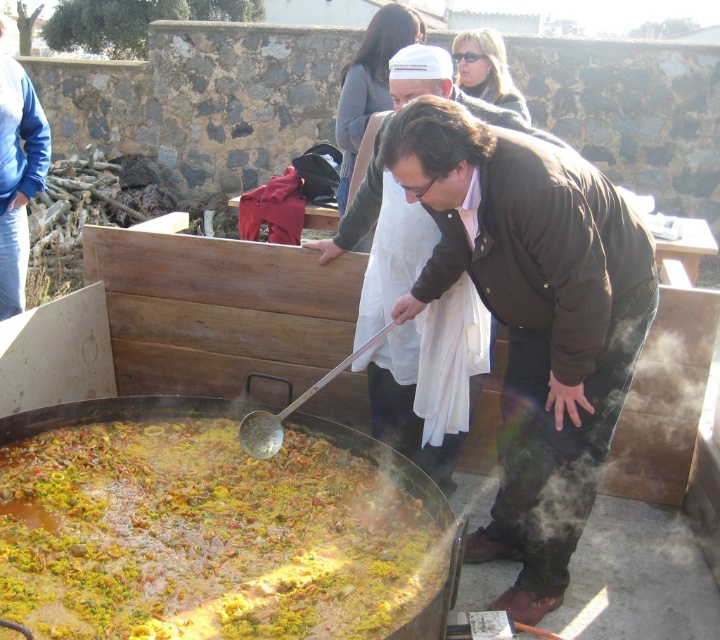
You are a food critic standing at the location of the blue cotton robe at left. You want to taste the yellow rice at center. Can you reach it without moving from your current position? Assume your arm can extend 1.5 meters.

The distance between the yellow rice at center and the blue cotton robe at left is 2.07 meters. Since your arm can only extend 1.5 meters, you cannot reach the yellow rice at center without moving from your current position.

You are a guest at the outdoor cooking event and want to find the taller robe between the blue cotton robe at left and the white cotton robe at upper center. Which one should you look for?

The blue cotton robe at left is taller than the white cotton robe at upper center, so you should look for the blue cotton robe at left.

You are standing at the origin point of the coordinate system. You see two points, point (22, 188) and point (342, 93). Which point is closer to you?

Point (22, 188) is in front of point (342, 93), so it is closer to you.